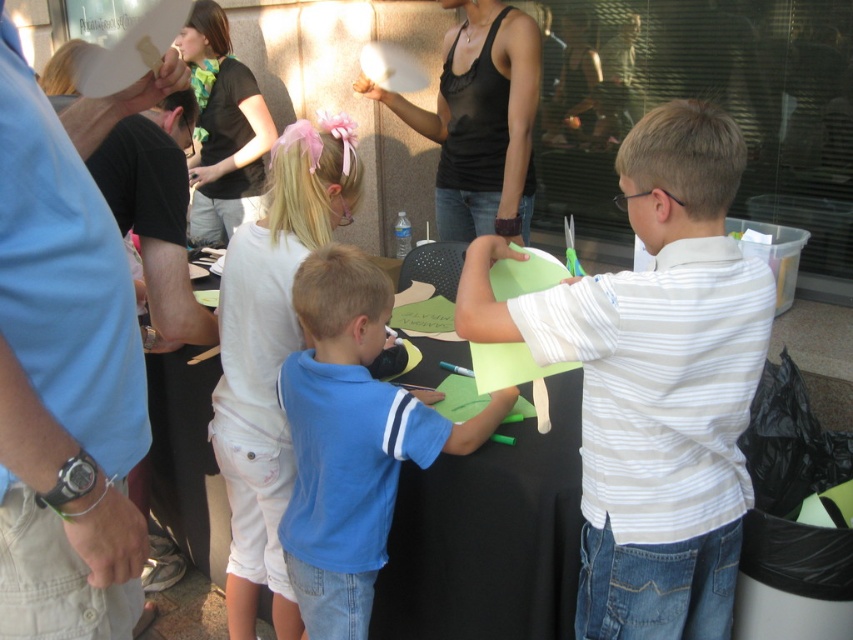
You are a photographer taking a picture of the blue shirt at upper left and the black tank top at upper center. Which person should you adjust to be closer to the camera to ensure both are in focus?

The blue shirt at upper left has a lesser height compared to black tank top at upper center, so you should adjust the blue shirt at upper left to be closer to the camera to ensure both are in focus.